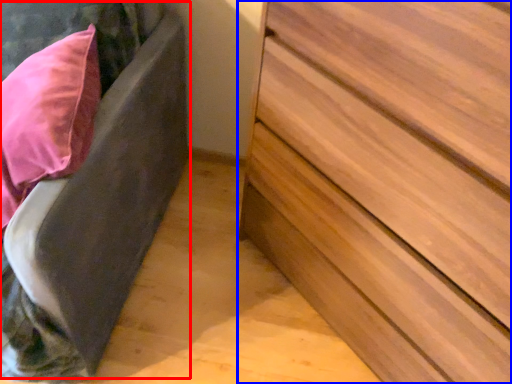
Question: Which object appears farthest to the camera in this image, bed frame (highlighted by a red box) or chest of drawers (highlighted by a blue box)?

Choices:
 (A) bed frame
 (B) chest of drawers

Answer: (A)